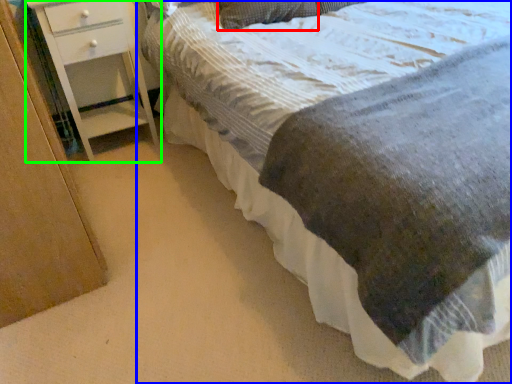
Question: Which is nearer to the pillow (highlighted by a red box)? bed (highlighted by a blue box) or chest of drawers (highlighted by a green box).

Choices:
 (A) bed
 (B) chest of drawers

Answer: (A)